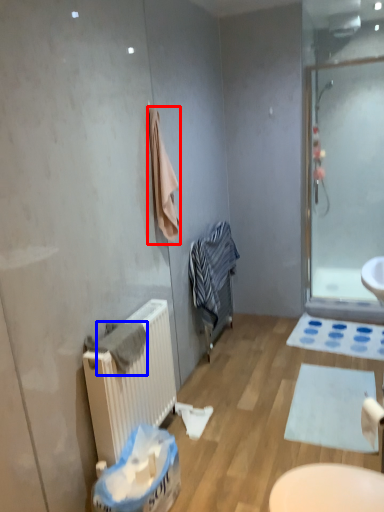
Question: Which object appears closest to the camera in this image, bath towel (highlighted by a red box) or bath towel (highlighted by a blue box)?

Choices:
 (A) bath towel
 (B) bath towel

Answer: (B)